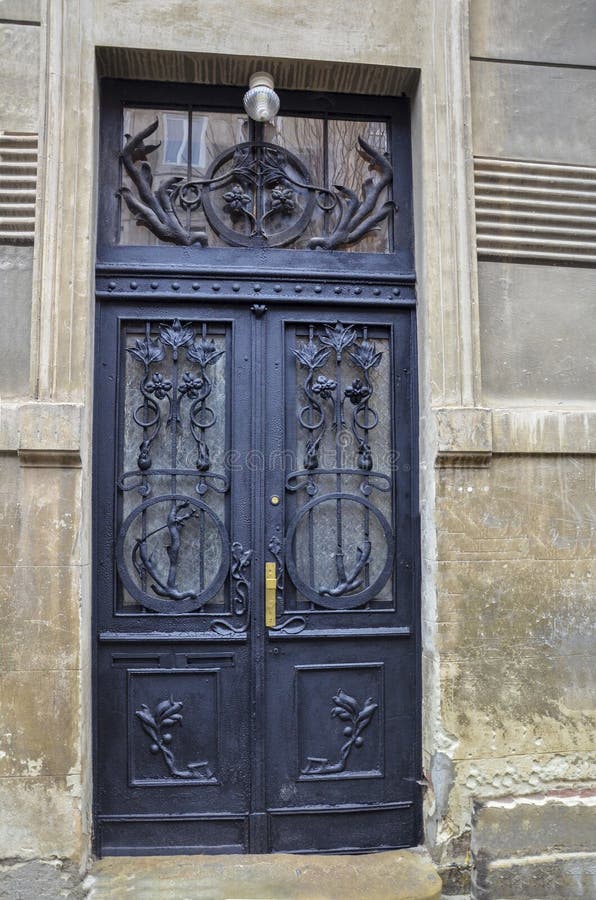
Locate an element on the screen. window is located at coordinates (210, 141), (300, 130), (330, 457), (185, 455).